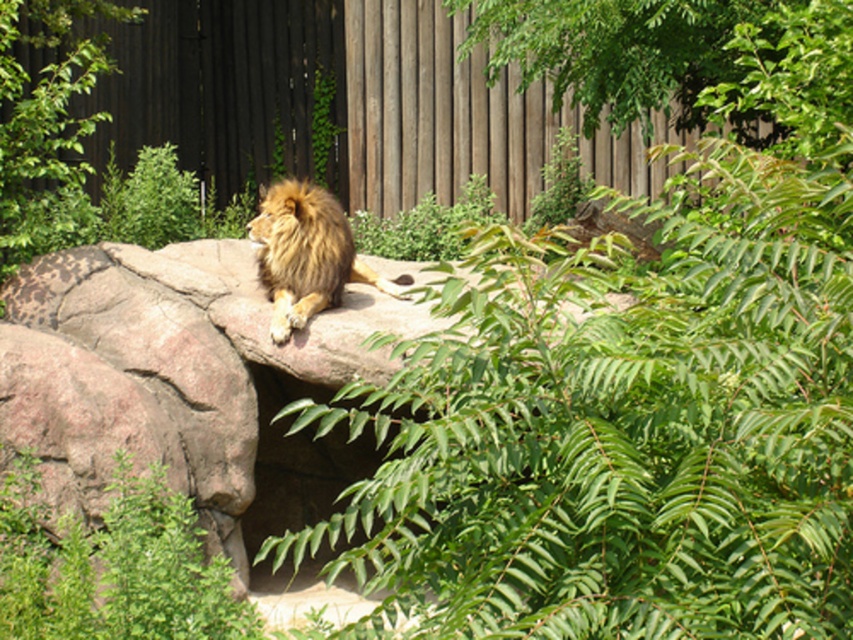
From the picture: You are a photographer trying to capture the golden fur lion at center from a lower angle. Since the brown rough rock at center is in the way, can you see the lion over the rock?

The brown rough rock at center is taller than the golden fur lion at center, so the lion would be hidden behind the rock when viewed from a lower angle.

You are standing at the camera position and want to take a photo of the lion. The camera has a maximum focus range of 7 meters. Will the point at coordinates point (x=367, y=296) be in focus?

The point at coordinates point (x=367, y=296) is 7.59 meters away from the camera, which exceeds the maximum focus range of 7 meters. Therefore, the point will not be in focus.

You are a photographer trying to capture the golden fur lion at center. You notice the brown rough rock at center is blocking part of the lion. Can you determine if the rock is big enough to block the entire lion from view?

The brown rough rock at center is larger in size than golden fur lion at center, so yes, the rock can block the entire lion from view since it is bigger.